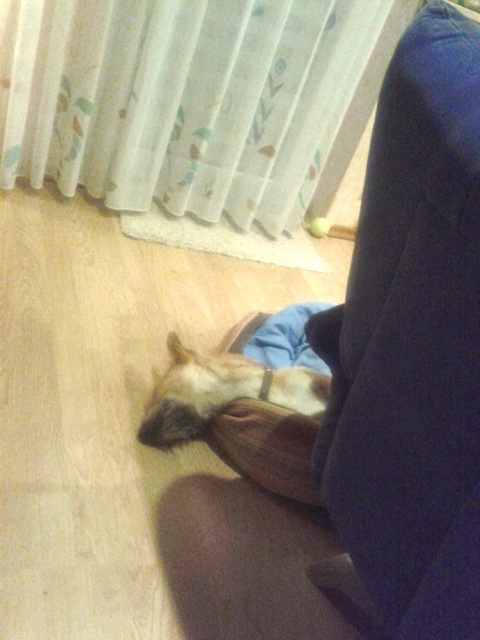
Question: Does white sheer curtain at upper center have a greater width compared to fuzzy brown dog at lower center?

Choices:
 (A) no
 (B) yes

Answer: (B)

Question: Is fuzzy brown dog at lower center smaller than brown fabric pillow at lower center?

Choices:
 (A) yes
 (B) no

Answer: (B)

Question: Which is nearer to the white sheer curtain at upper center?

Choices:
 (A) brown fabric pillow at lower center
 (B) fuzzy brown dog at lower center

Answer: (B)

Question: Estimate the real-world distances between objects in this image. Which object is closer to the white sheer curtain at upper center?

Choices:
 (A) brown fabric pillow at lower center
 (B) fuzzy brown dog at lower center

Answer: (B)

Question: Considering the real-world distances, which object is farthest from the fuzzy brown dog at lower center?

Choices:
 (A) white sheer curtain at upper center
 (B) brown fabric pillow at lower center

Answer: (A)

Question: Can you confirm if white sheer curtain at upper center is positioned to the left of fuzzy brown dog at lower center?

Choices:
 (A) no
 (B) yes

Answer: (B)